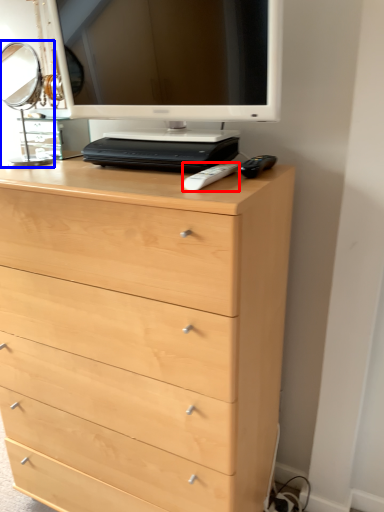
Question: Which of the following is the closest to the observer, remote (highlighted by a red box) or table lamp (highlighted by a blue box)?

Choices:
 (A) remote
 (B) table lamp

Answer: (A)